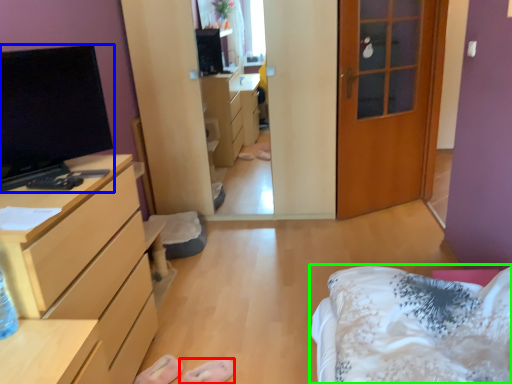
Question: Based on their relative distances, which object is nearer to shoe (highlighted by a red box)? Choose from television (highlighted by a blue box) and bed (highlighted by a green box).

Choices:
 (A) television
 (B) bed

Answer: (B)